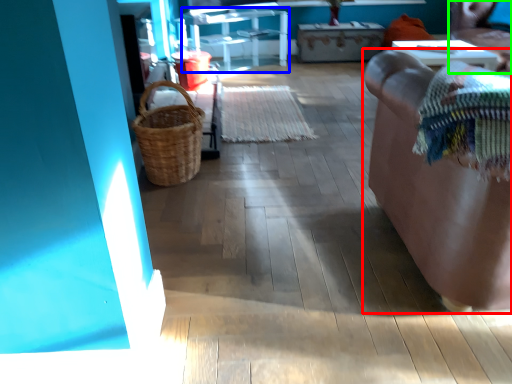
Question: Estimate the real-world distances between objects in this image. Which object is farther from furniture (highlighted by a red box), furniture (highlighted by a blue box) or chair (highlighted by a green box)?

Choices:
 (A) furniture
 (B) chair

Answer: (A)